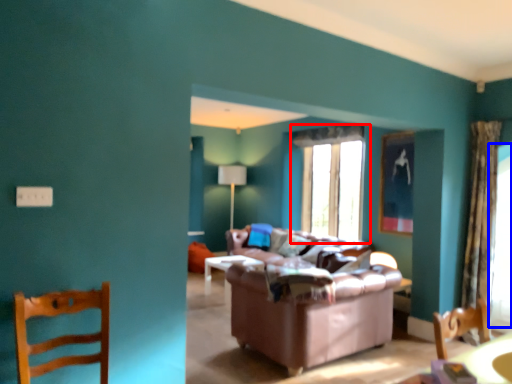
Question: Which of the following is the farthest to the observer, window (highlighted by a red box) or window screen (highlighted by a blue box)?

Choices:
 (A) window
 (B) window screen

Answer: (A)